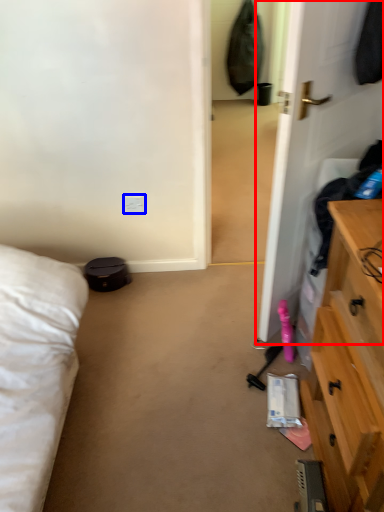
Question: Which of the following is the closest to the observer, door (highlighted by a red box) or electric outlet (highlighted by a blue box)?

Choices:
 (A) door
 (B) electric outlet

Answer: (A)